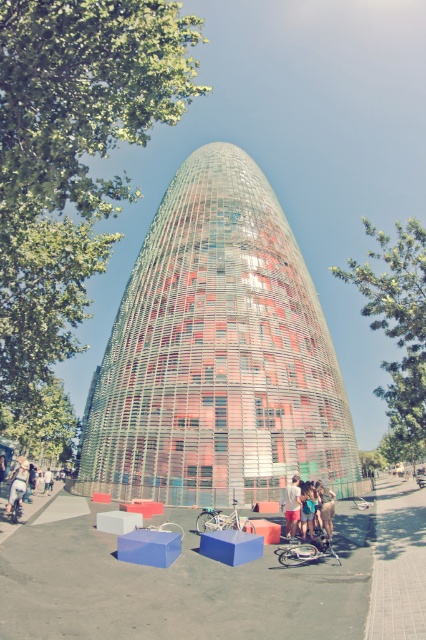
You are standing in the public area of the scene and want to move towards the multicolored glass tower at center. Which direction should you walk relative to the light blue denim shorts at lower left?

The multicolored glass tower at center is positioned on the right side of light blue denim shorts at lower left, so you should walk to the right relative to the light blue denim shorts at lower left to reach the multicolored glass tower at center.

You are standing in the architectural structure scene and want to move from the light blue denim shorts at lower left to the matte pink shorts at lower center. Which direction should you move in?

The matte pink shorts at lower center is to the right of the light blue denim shorts at lower left, so you should move to the right to reach it.